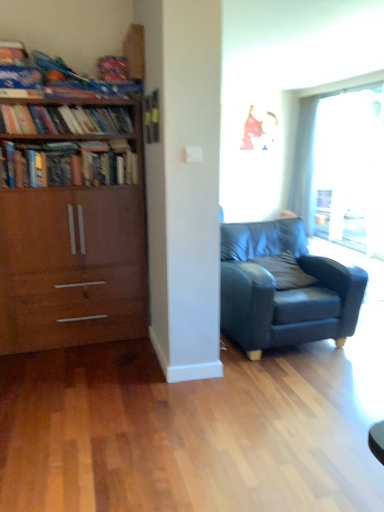
Question: Considering the relative sizes of white sheer curtain at upper right and gray fabric pillow at center in the image provided, is white sheer curtain at upper right smaller than gray fabric pillow at center?

Choices:
 (A) yes
 (B) no

Answer: (B)

Question: Does white sheer curtain at upper right have a greater width compared to gray fabric pillow at center?

Choices:
 (A) no
 (B) yes

Answer: (A)

Question: Is the depth of white sheer curtain at upper right greater than that of gray fabric pillow at center?

Choices:
 (A) yes
 (B) no

Answer: (A)

Question: From a real-world perspective, is white sheer curtain at upper right on top of gray fabric pillow at center?

Choices:
 (A) no
 (B) yes

Answer: (B)

Question: From the image's perspective, is white sheer curtain at upper right above gray fabric pillow at center?

Choices:
 (A) yes
 (B) no

Answer: (A)

Question: From the image's perspective, is white sheer curtain at upper right located beneath gray fabric pillow at center?

Choices:
 (A) yes
 (B) no

Answer: (B)

Question: Is wooden bookcase at left far away from matte black armchair at center?

Choices:
 (A) yes
 (B) no

Answer: (A)

Question: From a real-world perspective, is wooden bookcase at left positioned over matte black armchair at center based on gravity?

Choices:
 (A) yes
 (B) no

Answer: (A)

Question: Considering the relative sizes of wooden bookcase at left and matte black armchair at center in the image provided, is wooden bookcase at left bigger than matte black armchair at center?

Choices:
 (A) no
 (B) yes

Answer: (B)

Question: Is matte black armchair at center inside wooden bookcase at left?

Choices:
 (A) no
 (B) yes

Answer: (A)

Question: From the image's perspective, is wooden bookcase at left below matte black armchair at center?

Choices:
 (A) no
 (B) yes

Answer: (A)

Question: Is wooden bookcase at left behind matte black armchair at center?

Choices:
 (A) no
 (B) yes

Answer: (A)

Question: From a real-world perspective, is hardcover books at left, the first book when ordered from bottom to top, positioned over gray fabric pillow at center based on gravity?

Choices:
 (A) no
 (B) yes

Answer: (B)